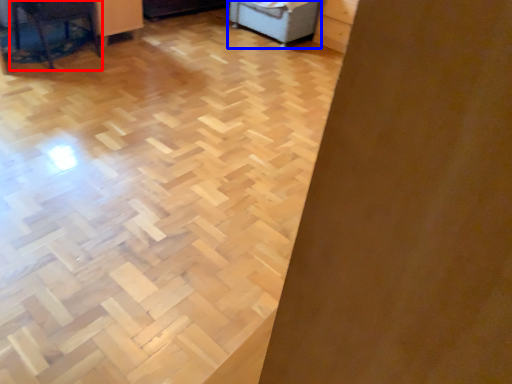
Question: Which object is further to the camera taking this photo, furniture (highlighted by a red box) or furniture (highlighted by a blue box)?

Choices:
 (A) furniture
 (B) furniture

Answer: (B)